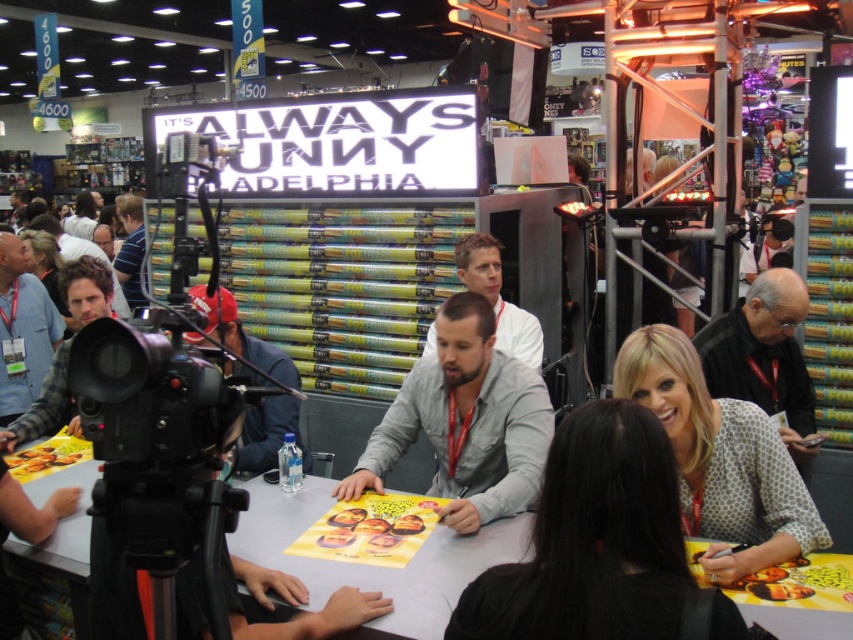
You are a photographer standing at the event and want to take a photo of the matte black cap at center without including any people in the background. The camera you are using has a depth of field that can focus clearly up to 1.5 meters away. Can you capture the cap clearly while keeping the background blurred?

The matte black cap at center is 1.42 meters away from the viewer. Since the camera can focus up to 1.5 meters, it can capture the cap clearly within that range. By adjusting the aperture to a wide setting, you can blur the background while keeping the cap in focus.

You are an event organizer at the convention and need to ensure that all attendees are wearing shirts of equal size. You notice two attendees wearing a plaid flannel shirt at left and a blue shirt at left. Which shirt should you ask the attendee to change into to comply with the dress code?

The plaid flannel shirt at left has a smaller size compared to the blue shirt at left, so the attendee wearing the plaid flannel shirt at left should change into a larger shirt to meet the dress code requirement for equal sizes.